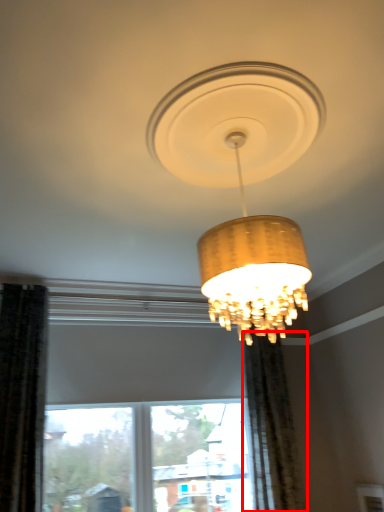
Question: Considering the relative positions of curtain (annotated by the red box) and lamp in the image provided, where is curtain (annotated by the red box) located with respect to the staircase?

Choices:
 (A) right
 (B) left

Answer: (A)